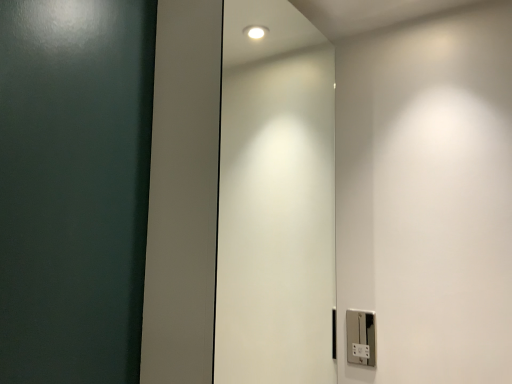
Question: Would you say white glossy elevator door at center is inside or outside silver metallic light switch at lower right?

Choices:
 (A) outside
 (B) inside

Answer: (A)

Question: From a real-world perspective, relative to silver metallic light switch at lower right, is white glossy elevator door at center vertically above or below?

Choices:
 (A) above
 (B) below

Answer: (A)

Question: From the image's perspective, is white glossy elevator door at center positioned above or below silver metallic light switch at lower right?

Choices:
 (A) below
 (B) above

Answer: (B)

Question: From the image's perspective, relative to white glossy elevator door at center, is silver metallic light switch at lower right above or below?

Choices:
 (A) above
 (B) below

Answer: (B)

Question: Is silver metallic light switch at lower right wider or thinner than white glossy elevator door at center?

Choices:
 (A) wide
 (B) thin

Answer: (B)

Question: From a real-world perspective, is silver metallic light switch at lower right positioned above or below white glossy elevator door at center?

Choices:
 (A) below
 (B) above

Answer: (A)

Question: Based on their sizes in the image, would you say silver metallic light switch at lower right is bigger or smaller than white glossy elevator door at center?

Choices:
 (A) big
 (B) small

Answer: (B)